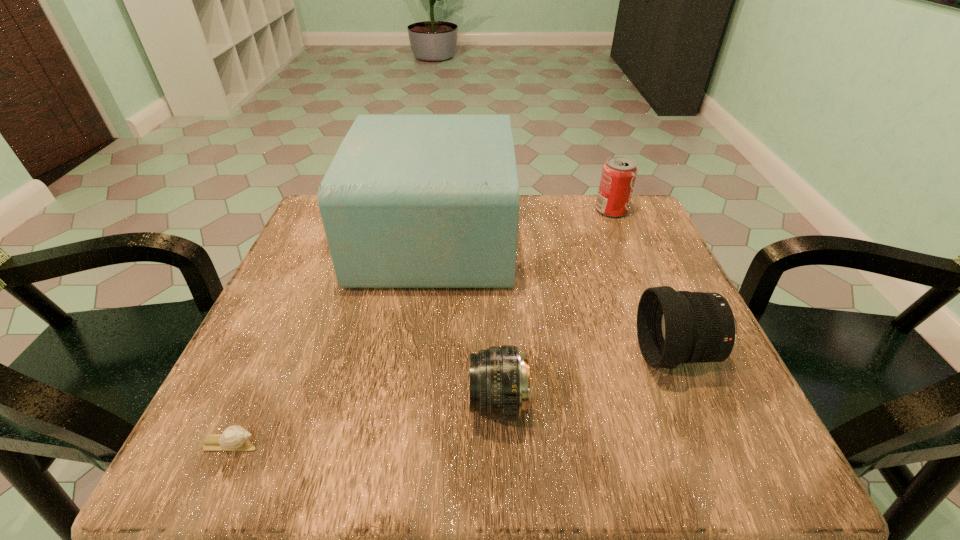
Identify the location of free region located 0.140m at the front element of the right telephoto lens. The image size is (960, 540). (561, 354).

The width and height of the screenshot is (960, 540). Find the location of `free location located at the front element of the right telephoto lens`. free location located at the front element of the right telephoto lens is located at coordinates (543, 354).

In order to click on free location located at the front element of the shorter telephoto lens in this screenshot , I will do `click(388, 403)`.

This screenshot has height=540, width=960. What are the coordinates of `free space located at the front element of the shorter telephoto lens` in the screenshot? It's located at (439, 403).

At what (x,y) coordinates should I click in order to perform the action: click on vacant space situated at the front element of the shorter telephoto lens. Please return your answer as a coordinate pair (x, y). Looking at the image, I should click on (363, 403).

At what (x,y) coordinates should I click in order to perform the action: click on vacant space situated on the shell of the shortest object. Please return your answer as a coordinate pair (x, y). Looking at the image, I should click on (334, 444).

Identify the location of radio receiver situated at the far edge. The image size is (960, 540). (409, 201).

The width and height of the screenshot is (960, 540). I want to click on soda can positioned at the far edge, so [x=619, y=173].

I want to click on telephoto lens present at the near edge, so click(x=500, y=389).

Where is `escargot at the near edge`? The image size is (960, 540). escargot at the near edge is located at coordinates (234, 438).